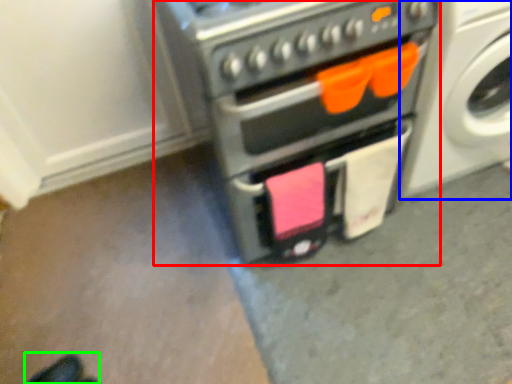
Question: Which is nearer to the home appliance (highlighted by a red box)? washing machine (highlighted by a blue box) or footwear (highlighted by a green box).

Choices:
 (A) washing machine
 (B) footwear

Answer: (A)